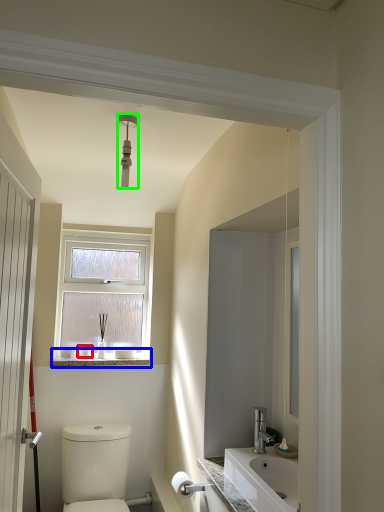
Question: Which object is the farthest from toiletry (highlighted by a red box)? Choose among these: window sill (highlighted by a blue box) or light fixture (highlighted by a green box).

Choices:
 (A) window sill
 (B) light fixture

Answer: (B)